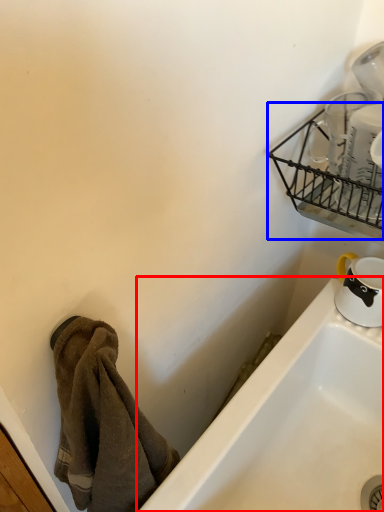
Question: Which point is closer to the camera, bathtub (highlighted by a red box) or basket (highlighted by a blue box)?

Choices:
 (A) bathtub
 (B) basket

Answer: (B)